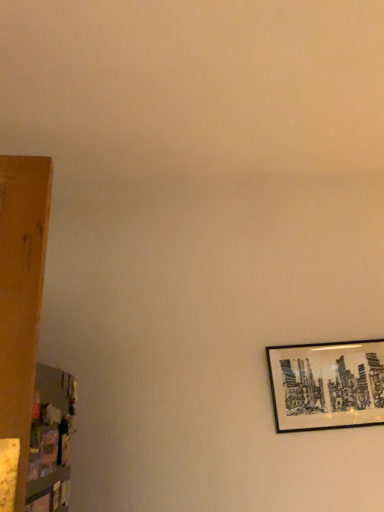
Question: Is wooden shelf at left next to black matte picture frame at right?

Choices:
 (A) yes
 (B) no

Answer: (B)

Question: Considering the relative sizes of wooden shelf at left and black matte picture frame at right in the image provided, is wooden shelf at left thinner than black matte picture frame at right?

Choices:
 (A) no
 (B) yes

Answer: (B)

Question: Is wooden shelf at left positioned behind black matte picture frame at right?

Choices:
 (A) yes
 (B) no

Answer: (B)

Question: From a real-world perspective, is wooden shelf at left located beneath black matte picture frame at right?

Choices:
 (A) yes
 (B) no

Answer: (A)

Question: Is black matte picture frame at right located within wooden shelf at left?

Choices:
 (A) no
 (B) yes

Answer: (A)

Question: Does wooden shelf at left have a smaller size compared to black matte picture frame at right?

Choices:
 (A) no
 (B) yes

Answer: (B)

Question: From the image's perspective, is black matte picture frame at right beneath wooden shelf at left?

Choices:
 (A) no
 (B) yes

Answer: (B)

Question: Does black matte picture frame at right have a greater height compared to wooden shelf at left?

Choices:
 (A) no
 (B) yes

Answer: (A)

Question: From the image's perspective, is black matte picture frame at right above wooden shelf at left?

Choices:
 (A) no
 (B) yes

Answer: (A)

Question: Are black matte picture frame at right and wooden shelf at left beside each other?

Choices:
 (A) yes
 (B) no

Answer: (B)

Question: Does black matte picture frame at right turn towards wooden shelf at left?

Choices:
 (A) yes
 (B) no

Answer: (B)

Question: Is black matte picture frame at right looking in the opposite direction of wooden shelf at left?

Choices:
 (A) no
 (B) yes

Answer: (A)

Question: Which is correct: black matte picture frame at right is inside wooden shelf at left, or outside of it?

Choices:
 (A) inside
 (B) outside

Answer: (B)